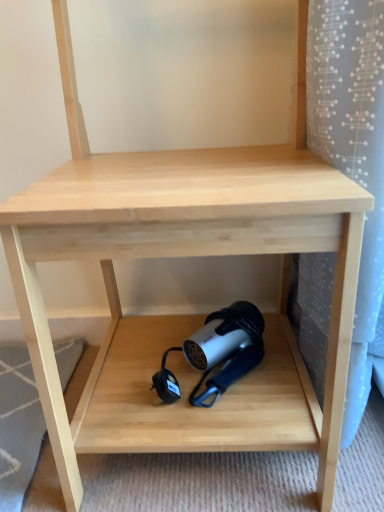
Locate an element on the screen. The height and width of the screenshot is (512, 384). silver metallic hair dryer at lower center is located at coordinates (217, 353).

Based on the photo, measure the distance between point (205, 360) and camera.

Point (205, 360) is 28.15 inches away from camera.

Describe the element at coordinates (217, 353) in the screenshot. This screenshot has height=512, width=384. I see `silver metallic hair dryer at lower center` at that location.

Find the location of a particular element. silver metallic hair dryer at lower center is located at coordinates (217, 353).